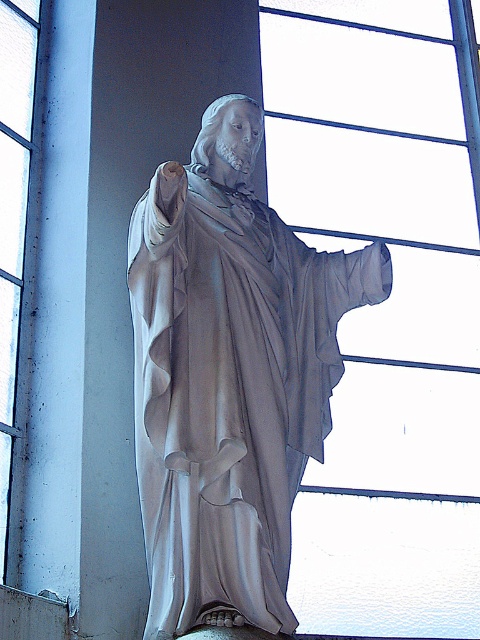
You are standing in a room with a large window to your back. You see the white marble statue at center. Based on its position, which direction should you turn to face it?

The white marble statue at center is located at coordinates 0.591 on the x axis and 0.477 on the y axis. Since you are facing the window which is behind you, you need to turn towards the statue. However, without knowing your exact position, it is difficult to determine the direction precisely. But generally, if the statue is at center, you might be facing away from it. To face the statue, you should turn around 180 degrees.

You are standing in a room with the statue of Jesus Christ. You want to know where the transparent glass window at upper center is located. Can you tell me its coordinates?

The transparent glass window at upper center is located at coordinates (384, 305).

You are an interior designer planning to place a new decorative item in the room. You have a 1.5 meter wide sculpture. The room already has the white marble statue at center and the transparent glass window at upper left. Based on their widths, can the new sculpture fit between them without overlapping?

The white marble statue at center is wider than the transparent glass window at upper left. Since the new sculpture is 1.5 meters wide, we need to know the exact widths of both existing objects to determine if there is enough space. However, based on the given information, the statue is wider, but without specific measurements, we cannot confirm if the total available space between them accommodates the new sculpture.